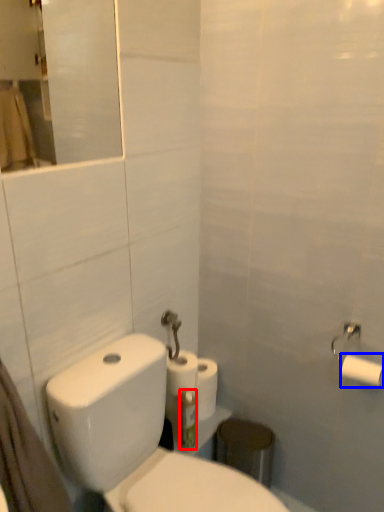
Question: Which object is closer to the camera taking this photo, toothbrush (highlighted by a red box) or toilet paper (highlighted by a blue box)?

Choices:
 (A) toothbrush
 (B) toilet paper

Answer: (B)